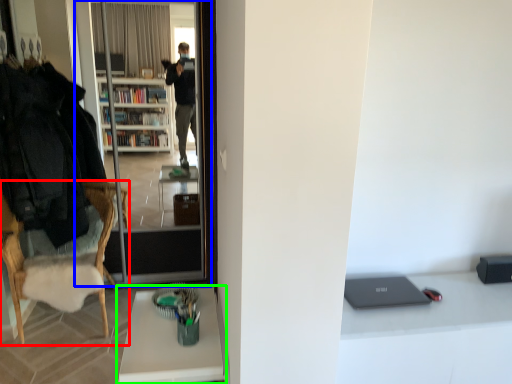
Question: Considering the real-world distances, which object is farthest from chair (highlighted by a red box)? screen door (highlighted by a blue box) or desk (highlighted by a green box)?

Choices:
 (A) screen door
 (B) desk

Answer: (B)